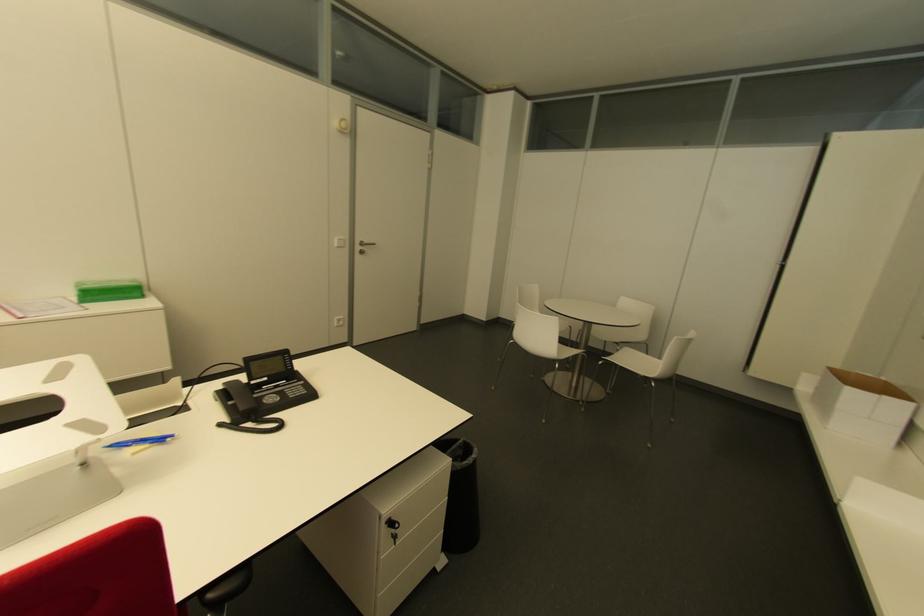
I want to click on black wastebasket, so click(462, 480).